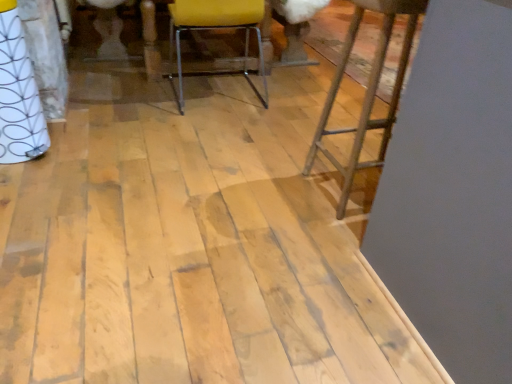
Where is `free space in front of rustic wood stool at right`? This screenshot has width=512, height=384. free space in front of rustic wood stool at right is located at coordinates (328, 241).